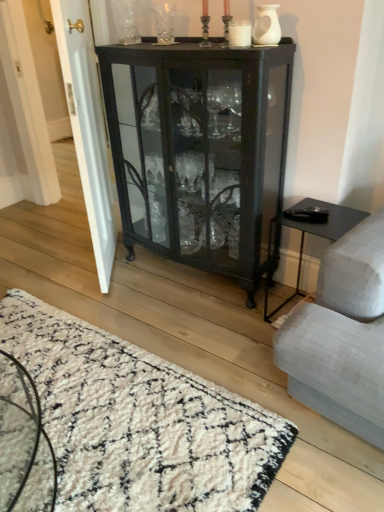
The image size is (384, 512). I want to click on free space in front of white glossy door at left, so click(x=116, y=301).